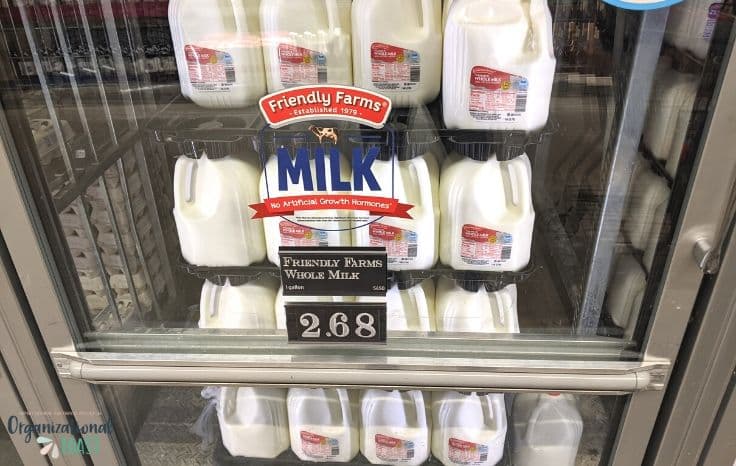
This screenshot has height=466, width=736. Identify the location of milk on top shelf. [x=208, y=10], [x=280, y=10], [x=368, y=10], [x=473, y=12].